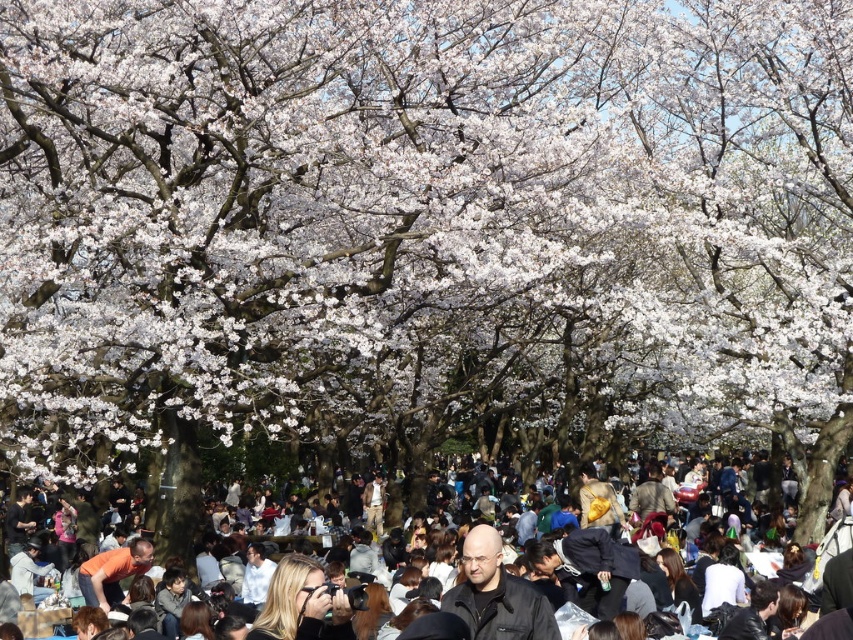
You are standing in the park and want to reach the point marked as point (473,616). If you can walk at a speed of 1.5 meters per second, how many seconds will it take you to reach that point?

The distance between you and point (473,616) is 70.90 meters. At a speed of 1.5 meters per second, it would take approximately 47.27 seconds to reach the point.

You are a photographer carrying a tripod that requires 50 feet of space to set up. You see the black leather jacket at center and the matte black jacket at lower center. Is there enough space between them to set up your equipment?

The distance between the black leather jacket at center and the matte black jacket at lower center is 45.52 feet, which is less than the required 50 feet. Therefore, there isn not enough space to set up the equipment between them.

You are standing in the park and want to take a photo of both point [518,586] and point [583,515]. Which point should you focus on first to ensure both are in the frame?

You should focus on point [518,586] first because it is closer to the camera than point [583,515], ensuring both points are within the frame.